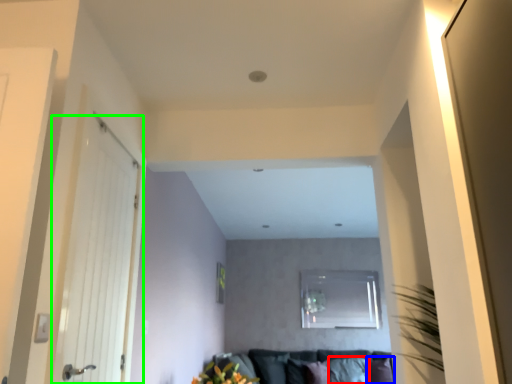
Question: Considering the real-world distances, which object is closest to pillow (highlighted by a red box)? pillow (highlighted by a blue box) or door (highlighted by a green box).

Choices:
 (A) pillow
 (B) door

Answer: (A)